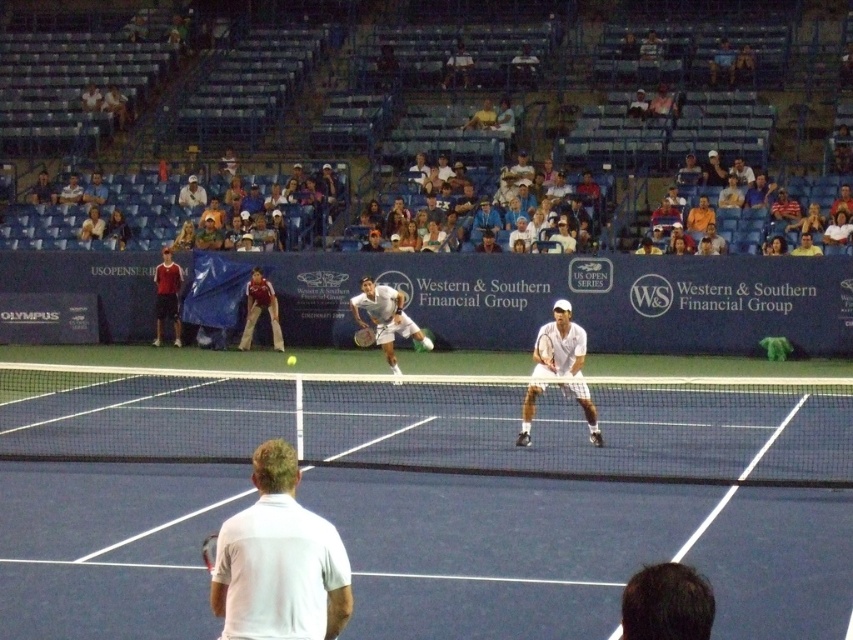
Can you confirm if white matte tennis racket at center is positioned to the right of matte brown pants at lower left?

Yes, white matte tennis racket at center is to the right of matte brown pants at lower left.

Does white matte tennis racket at center appear under matte brown pants at lower left?

Yes, white matte tennis racket at center is below matte brown pants at lower left.

Is point (555, 323) positioned after point (264, 298)?

No, (555, 323) is closer to viewer.

Find the location of a particular element. This screenshot has height=640, width=853. white matte tennis racket at center is located at coordinates (560, 344).

Between point (88, 368) and point (16, 380), which one is positioned behind?

Positioned behind is point (16, 380).

Who is more distant from viewer, (x=238, y=394) or (x=717, y=480)?

Positioned behind is point (x=238, y=394).

Find the location of a particular element. blue synthetic turf at center is located at coordinates (451, 428).

Can you confirm if white cotton shirt at upper center is taller than matte red shirt at left?

Correct, white cotton shirt at upper center is much taller as matte red shirt at left.

Is white cotton shirt at upper center bigger than matte red shirt at left?

Yes, white cotton shirt at upper center is bigger than matte red shirt at left.

Is point (161, 124) farther from viewer compared to point (164, 253)?

Yes, it is.

The height and width of the screenshot is (640, 853). Identify the location of white cotton shirt at upper center. (431, 90).